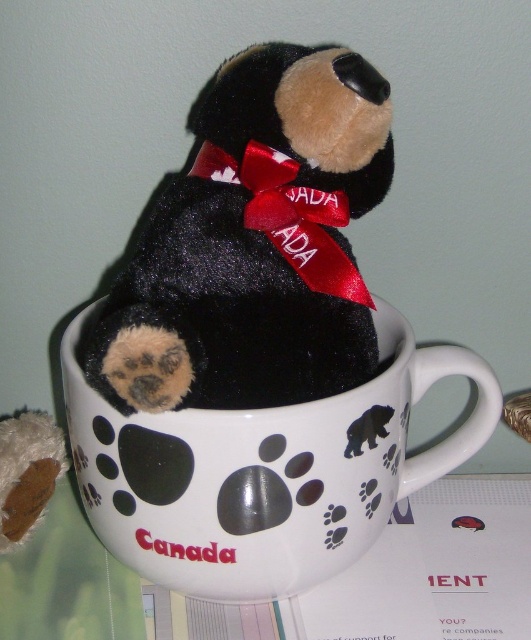
You are organizing a gift box and need to place the black plush bear at center and the white glossy mug at center. According to the image, which object should be placed to the left side of the other?

The black plush bear at center should be placed to the left of the white glossy mug at center because the description states that the black plush bear at center is to the left of the white glossy mug at center.